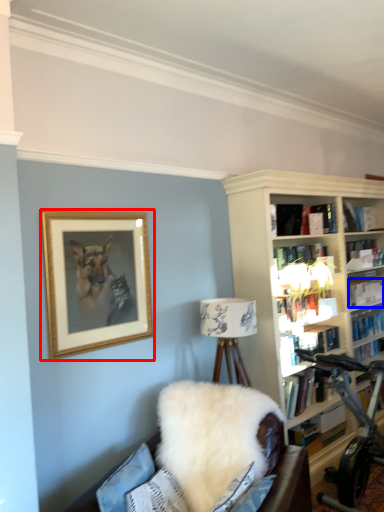
Question: Which of the following is the closest to the observer, picture frame (highlighted by a red box) or book (highlighted by a blue box)?

Choices:
 (A) picture frame
 (B) book

Answer: (A)